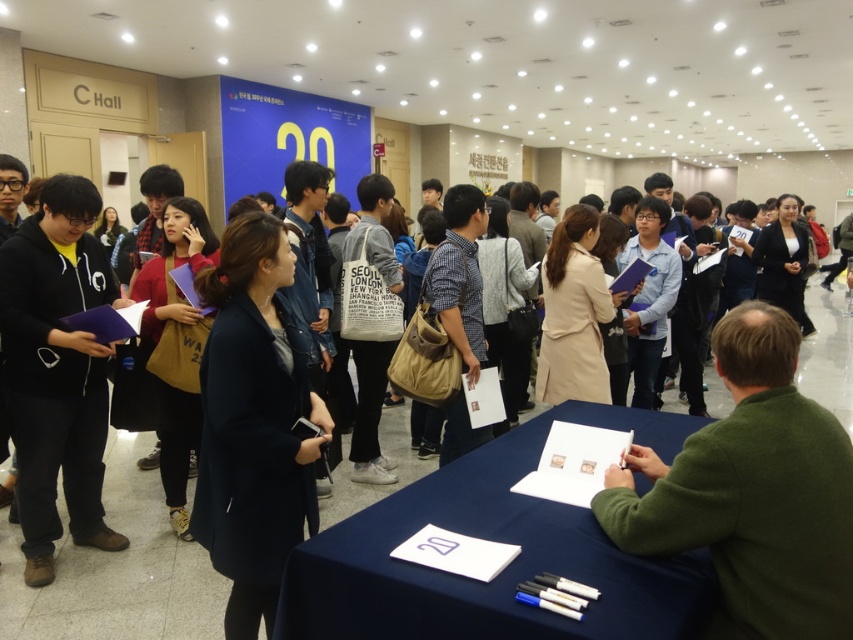
Question: Which point is farther to the camera?

Choices:
 (A) black matte hoodie at left
 (B) blue fabric table at lower center

Answer: (A)

Question: Is blue fabric table at lower center bigger than black matte hoodie at left?

Choices:
 (A) no
 (B) yes

Answer: (B)

Question: Can you confirm if blue fabric table at lower center is positioned above black matte hoodie at left?

Choices:
 (A) yes
 (B) no

Answer: (B)

Question: Can you confirm if blue fabric table at lower center is positioned below black matte hoodie at left?

Choices:
 (A) no
 (B) yes

Answer: (B)